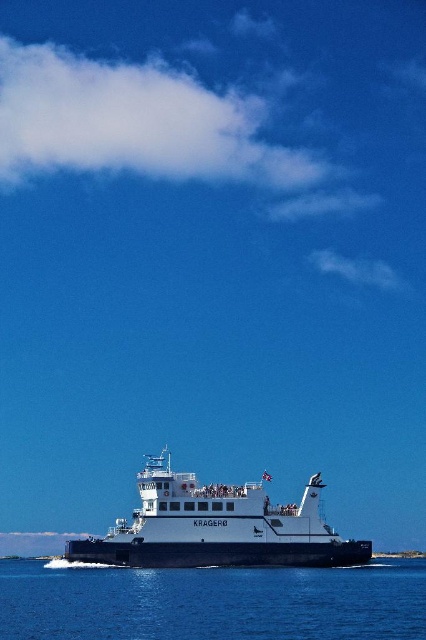
You are standing on the deck of the ferry named KRAGERO and looking down. There is a point at coordinate [212,602]. What do you see at that point?

At the point [212,602], you see transparent blue water at lower center.

You are standing on the deck of the ferry KRAGERO and want to reach a specific point marked at coordinates point (x=135, y=598). If your current position is 50 meters away from that point, can you safely walk towards it without any obstacles?

The distance of point (x=135, y=598) from viewer is 104.79 meters. Since you are currently 50 meters away from it, you still need to cover an additional 54.79 meters to reach the point. However, the scene description does not mention any obstacles on the deck, so assuming the path is clear, you can proceed safely.

You are a passenger on the white matte ferry at center and want to see the transparent blue water at lower center. Can you see the water from your current position on the ferry?

The transparent blue water at lower center is shorter than white matte ferry at center, so yes, the passenger can see the transparent blue water at lower center from their position on the ferry because the water is lower and not obstructed by the ferry itself.